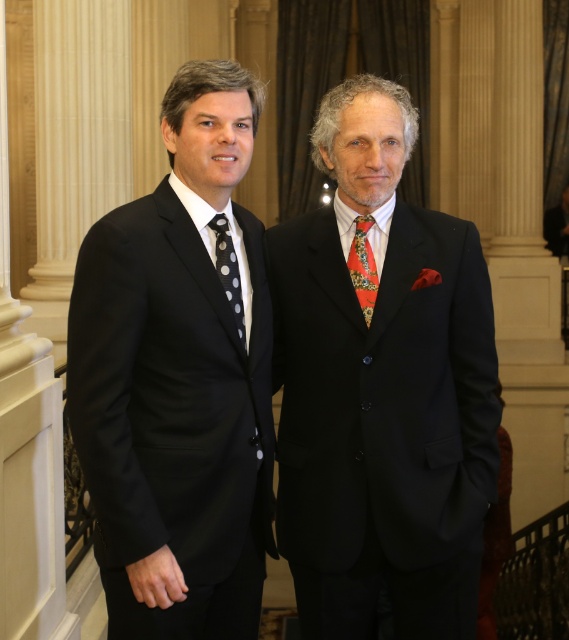
Does point (340, 273) come farther from viewer compared to point (232, 310)?

Yes, it is.

Which is behind, point (294, 572) or point (217, 236)?

Positioned behind is point (294, 572).

This screenshot has height=640, width=569. I want to click on matte black suit at center, so click(381, 388).

Can you confirm if matte black suit at center is smaller than black satin suit at left?

Correct, matte black suit at center occupies less space than black satin suit at left.

Is matte black suit at center thinner than black satin suit at left?

Yes.

Which is in front, point (333, 532) or point (216, 445)?

Point (216, 445)

Where is `matte black suit at center`? This screenshot has width=569, height=640. matte black suit at center is located at coordinates (381, 388).

What do you see at coordinates (381, 388) in the screenshot?
I see `matte black suit at center` at bounding box center [381, 388].

This screenshot has width=569, height=640. What do you see at coordinates (381, 388) in the screenshot?
I see `matte black suit at center` at bounding box center [381, 388].

Locate an element on the screen. Image resolution: width=569 pixels, height=640 pixels. matte black suit at center is located at coordinates (x=381, y=388).